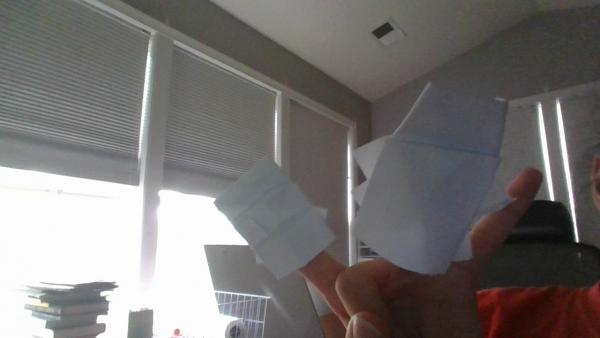
Identify the location of books. (83, 290), (79, 303), (86, 317), (92, 325).